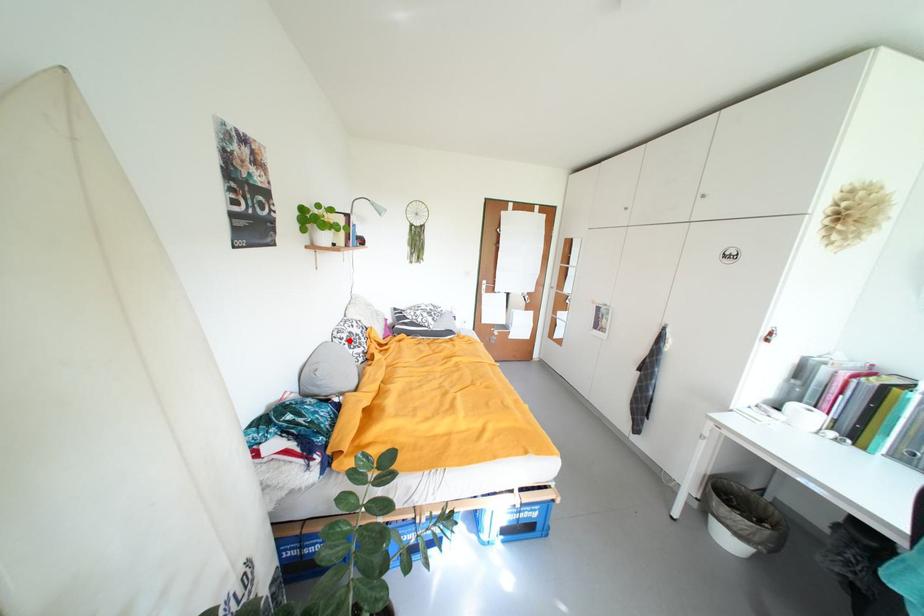
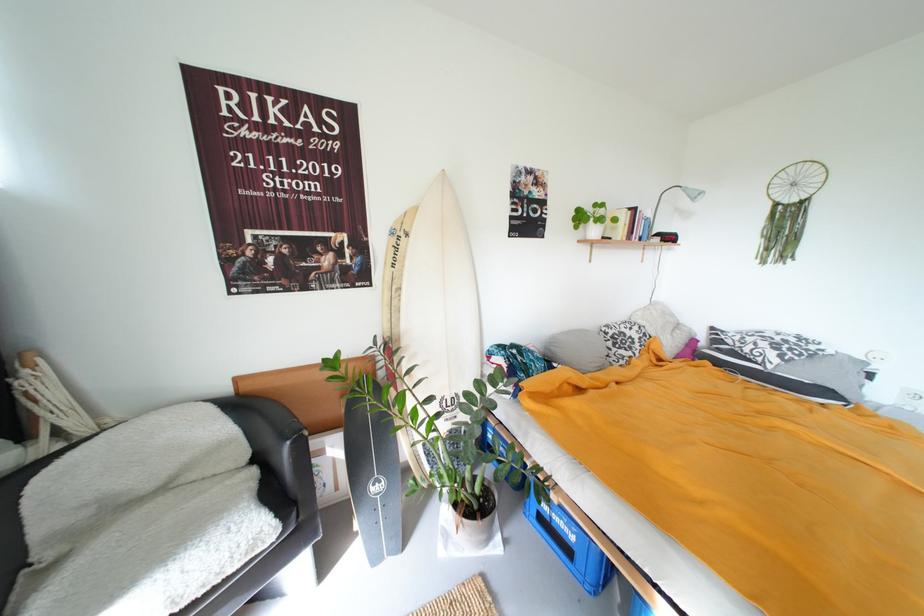
In the second image, find the point that corresponds to the highlighted location in the first image.

(614, 334)